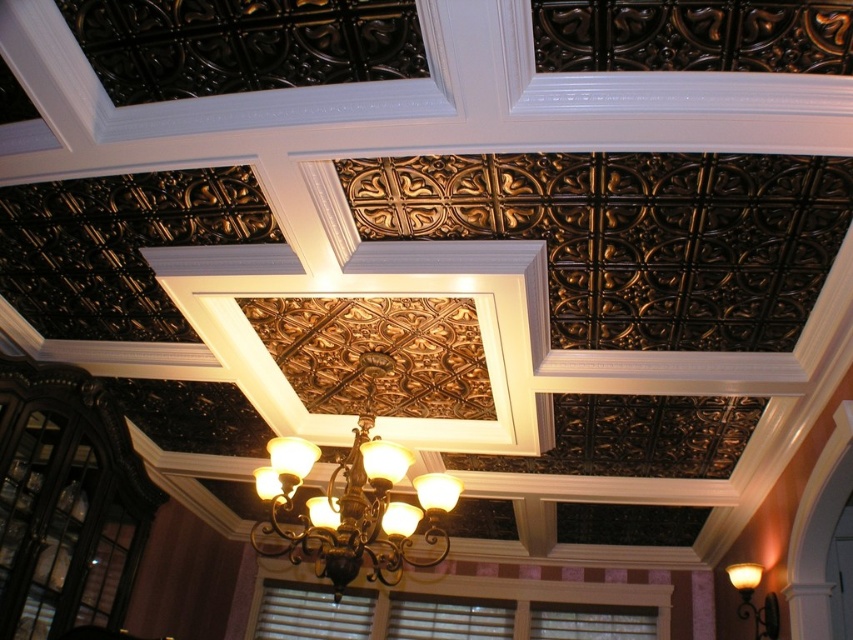
Can you confirm if bronze textured chandelier at center is positioned to the left of matte gold wall sconce at upper right?

Yes, bronze textured chandelier at center is to the left of matte gold wall sconce at upper right.

Which is behind, point (314, 458) or point (776, 628)?

The point (776, 628) is more distant.

Locate an element on the screen. The width and height of the screenshot is (853, 640). bronze textured chandelier at center is located at coordinates (355, 500).